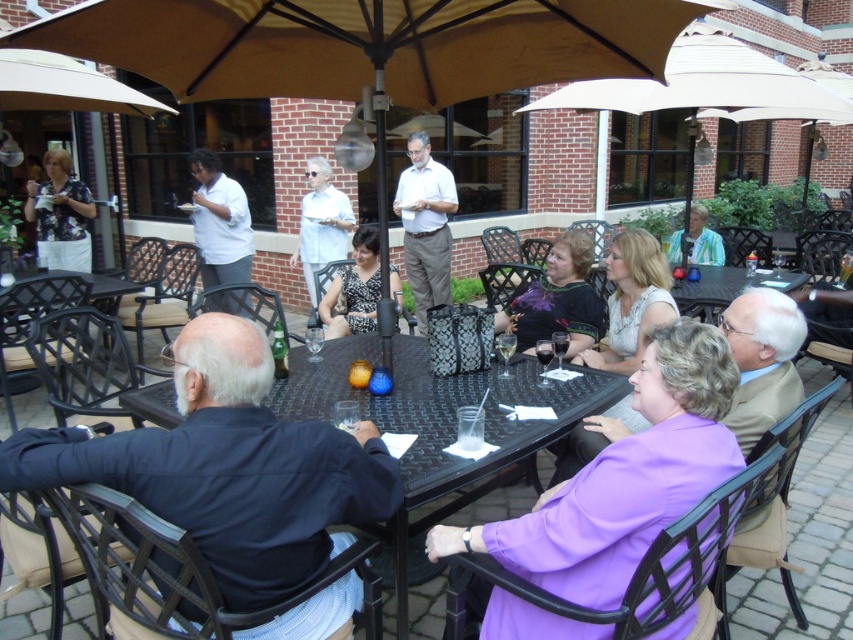
Question: Observing the image, what is the correct spatial positioning of beige fabric umbrella at upper center in reference to matte black dress at left?

Choices:
 (A) left
 (B) right

Answer: (B)

Question: Can you confirm if black textured dress at center is thinner than matte black dress at center?

Choices:
 (A) no
 (B) yes

Answer: (B)

Question: Which object is positioned farthest from the matte black dress at center?

Choices:
 (A) tan fabric umbrella at center
 (B) matte black dress at left
 (C) matte white shirt at center

Answer: (B)

Question: Can you confirm if matte black dress at left is thinner than white shirt at center?

Choices:
 (A) yes
 (B) no

Answer: (B)

Question: Estimate the real-world distances between objects in this image. Which object is farther from the matte black dress at left?

Choices:
 (A) black textured dress at center
 (B) striped shirt at center
 (C) matte black dress at center
 (D) tan fabric umbrella at center

Answer: (B)

Question: Estimate the real-world distances between objects in this image. Which object is closer to the beige fabric umbrella at upper center?

Choices:
 (A) matte black dress at left
 (B) purple fabric jacket at center
 (C) matte white shirt at center

Answer: (C)